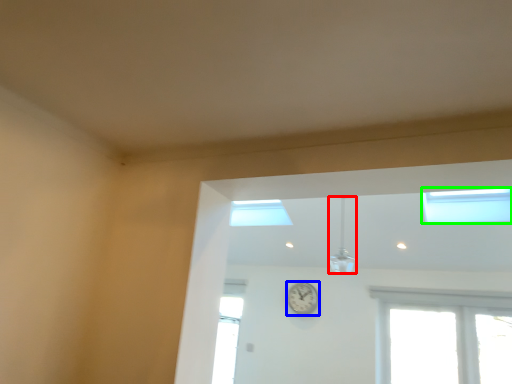
Question: Estimate the real-world distances between objects in this image. Which object is closer to light fixture (highlighted by a red box), clock (highlighted by a blue box) or window (highlighted by a green box)?

Choices:
 (A) clock
 (B) window

Answer: (A)